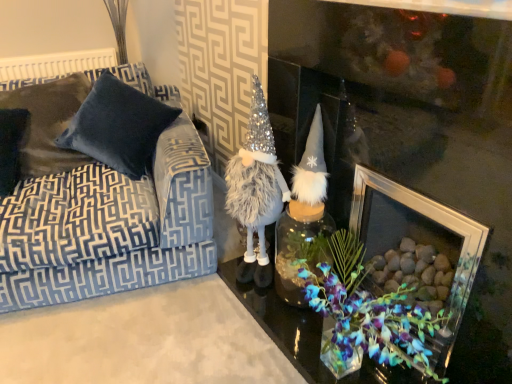
Question: Considering the relative positions of fuzzy silver/grey gnome at center and velvet pillow at left, positioned as the 2th pillow in right-to-left order, in the image provided, is fuzzy silver/grey gnome at center to the right of velvet pillow at left, positioned as the 2th pillow in right-to-left order, from the viewer's perspective?

Choices:
 (A) no
 (B) yes

Answer: (B)

Question: From a real-world perspective, is fuzzy silver/grey gnome at center on top of velvet pillow at left, positioned as the 2th pillow in right-to-left order?

Choices:
 (A) yes
 (B) no

Answer: (B)

Question: Is fuzzy silver/grey gnome at center located outside velvet pillow at left, positioned as the 2th pillow in right-to-left order?

Choices:
 (A) no
 (B) yes

Answer: (B)

Question: Is fuzzy silver/grey gnome at center further to camera compared to velvet pillow at left, positioned as the 2th pillow in right-to-left order?

Choices:
 (A) yes
 (B) no

Answer: (B)

Question: Is fuzzy silver/grey gnome at center turned away from velvet pillow at left, positioned as the 2th pillow in right-to-left order?

Choices:
 (A) no
 (B) yes

Answer: (A)

Question: Is the depth of fuzzy silver/grey gnome at center less than that of velvet pillow at left, which is the 1th pillow in left-to-right order?

Choices:
 (A) no
 (B) yes

Answer: (B)

Question: Is fuzzy silver/grey gnome at center placed right next to velvet dark blue pillow at left, the first pillow positioned from the right?

Choices:
 (A) yes
 (B) no

Answer: (B)

Question: Does fuzzy silver/grey gnome at center have a lesser width compared to velvet dark blue pillow at left, which appears as the 2th pillow when viewed from the left?

Choices:
 (A) no
 (B) yes

Answer: (B)

Question: Considering the relative positions of fuzzy silver/grey gnome at center and velvet dark blue pillow at left, which appears as the 2th pillow when viewed from the left, in the image provided, is fuzzy silver/grey gnome at center to the left of velvet dark blue pillow at left, which appears as the 2th pillow when viewed from the left, from the viewer's perspective?

Choices:
 (A) no
 (B) yes

Answer: (A)

Question: Is velvet dark blue pillow at left, the first pillow positioned from the right, at the back of fuzzy silver/grey gnome at center?

Choices:
 (A) no
 (B) yes

Answer: (A)

Question: From the image's perspective, is fuzzy silver/grey gnome at center under velvet dark blue pillow at left, the first pillow positioned from the right?

Choices:
 (A) yes
 (B) no

Answer: (A)

Question: Is fuzzy silver/grey gnome at center surrounding velvet dark blue pillow at left, the first pillow positioned from the right?

Choices:
 (A) yes
 (B) no

Answer: (B)

Question: Is fuzzy silver/grey gnome at center behind clear glass picture frame at center?

Choices:
 (A) no
 (B) yes

Answer: (B)